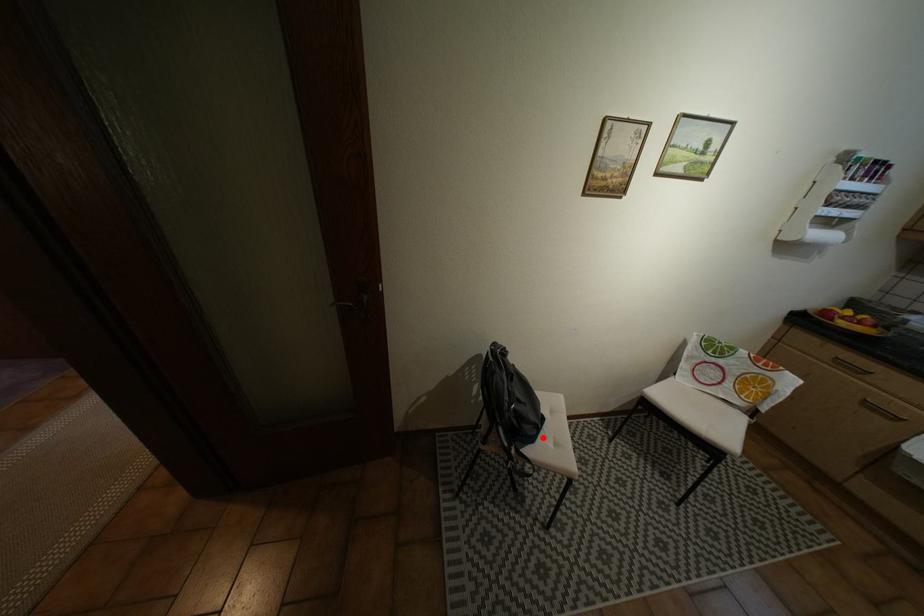
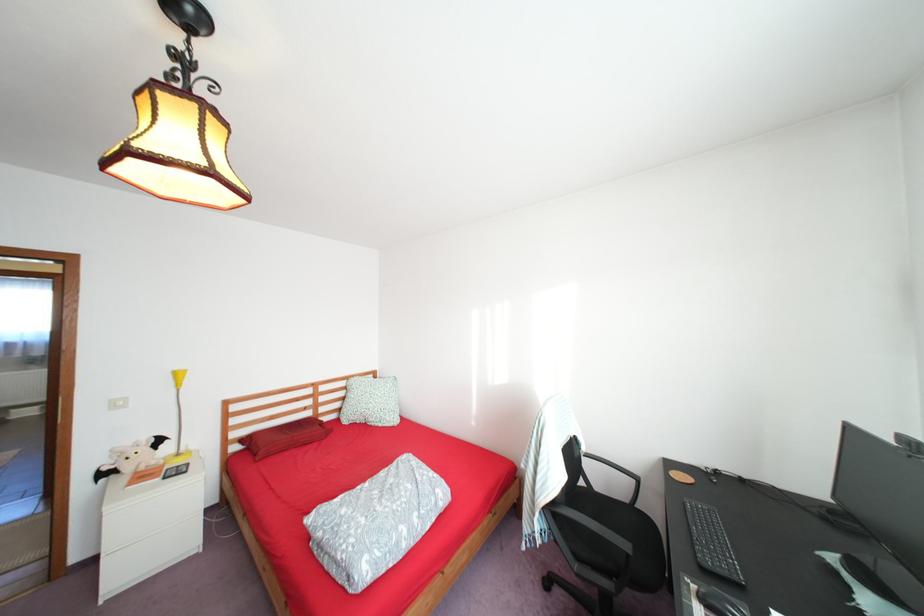
Question: I am providing you with two images of the same scene from different viewpoints. A red point is marked on the first image. Can you still see the location of the red point in image 2?

Choices:
 (A) Yes
 (B) No

Answer: (B)